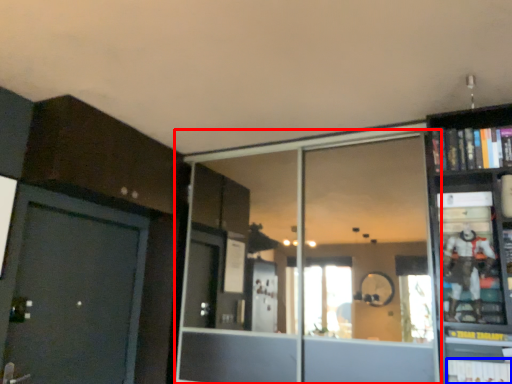
Question: Which object is closer to the camera taking this photo, glass door (highlighted by a red box) or book (highlighted by a blue box)?

Choices:
 (A) glass door
 (B) book

Answer: (B)